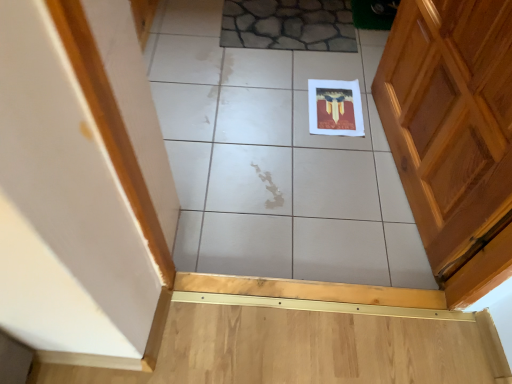
In order to click on vacant space in front of stone-like ceramic tile at upper center, the 1th ceramic tile from the top in this screenshot , I will do `click(282, 84)`.